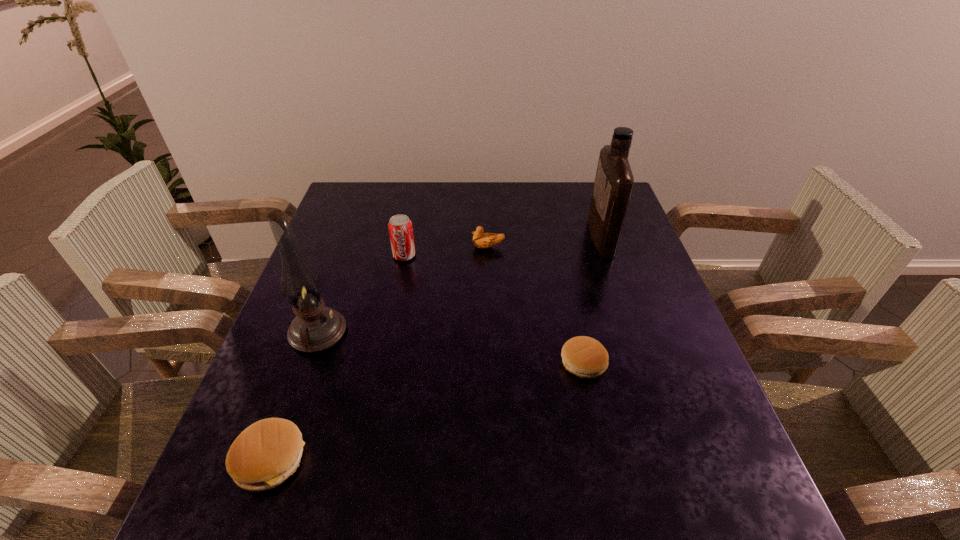
Where is `free region located 0.160m on the back of the shortest object`? The image size is (960, 540). free region located 0.160m on the back of the shortest object is located at coordinates (569, 295).

This screenshot has height=540, width=960. I want to click on free space located on the face of the duckling, so click(x=338, y=247).

Image resolution: width=960 pixels, height=540 pixels. In order to click on vacant space located on the face of the duckling in this screenshot , I will do `click(412, 247)`.

Identify the location of vacant space situated 0.300m on the face of the duckling. This screenshot has height=540, width=960. (366, 247).

This screenshot has height=540, width=960. Identify the location of free location located on the back of the oil lamp. (x=356, y=225).

The width and height of the screenshot is (960, 540). Identify the location of vacant space located 0.140m on the logo side of the soda can. (396, 299).

In order to click on free space located 0.140m on the label side of the rightmost object in this screenshot , I will do `click(542, 237)`.

You are a GUI agent. You are given a task and a screenshot of the screen. Output one action in this format:
    pyautogui.click(x=<x>, y=<y>)
    Task: Click on the vacant space situated 0.290m on the label side of the rightmost object
    
    Given the screenshot: What is the action you would take?
    pyautogui.click(x=491, y=237)

The width and height of the screenshot is (960, 540). In order to click on vacant space located 0.370m on the label side of the rightmost object in this screenshot , I will do `click(464, 237)`.

Locate an element on the screen. The image size is (960, 540). object that is positioned at the far edge is located at coordinates (614, 181).